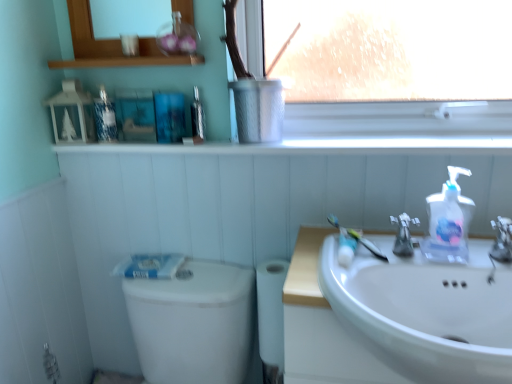
At what (x,y) coordinates should I click in order to perform the action: click on free region on the left part of metallic silver mouthwash at upper center, the second mouthwash from the left. Please return your answer as a coordinate pair (x, y). This screenshot has height=384, width=512. Looking at the image, I should click on point(152,141).